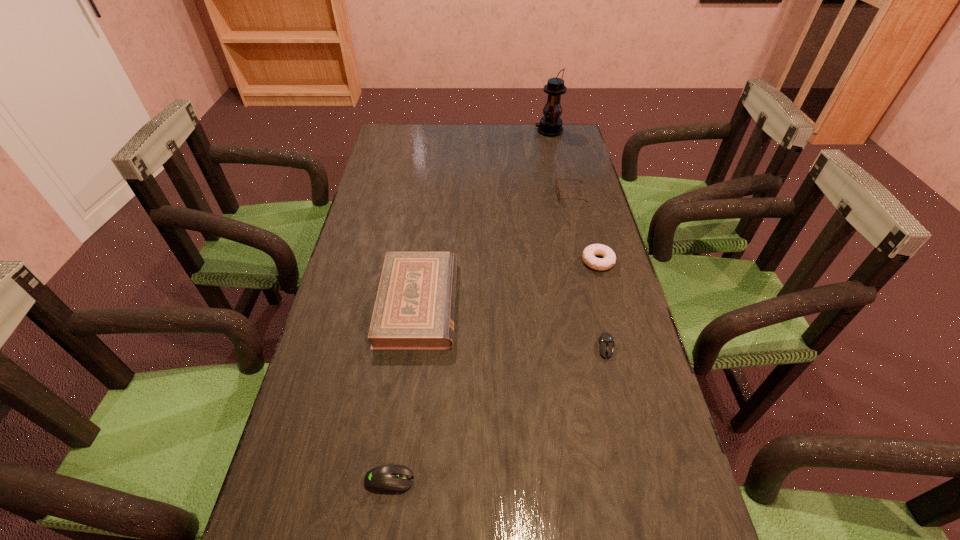
This screenshot has height=540, width=960. I want to click on the farthest object, so click(550, 125).

You are a GUI agent. You are given a task and a screenshot of the screen. Output one action in this format:
    pyautogui.click(x=<x>, y=<y>)
    Task: Click on the lantern
    The image size is (960, 540).
    Given the screenshot: What is the action you would take?
    click(550, 125)

Locate an element on the screen. sunglasses is located at coordinates tap(556, 188).

Where is `Bible`? Bible is located at coordinates (414, 309).

You are a GUI agent. You are given a task and a screenshot of the screen. Output one action in this format:
    pyautogui.click(x=<x>, y=<y>)
    Task: Click on the fourth tallest object
    This screenshot has width=960, height=540.
    Given the screenshot: What is the action you would take?
    pyautogui.click(x=589, y=253)

Find the location of a particular element. the fifth tallest object is located at coordinates (388, 479).

Locate an element on the screen. The width and height of the screenshot is (960, 540). the left computer mouse is located at coordinates (388, 479).

Locate an element on the screen. This screenshot has height=540, width=960. the farther computer mouse is located at coordinates (606, 341).

Find the location of a particular element. The image size is (960, 540). the shortest object is located at coordinates (606, 341).

Identify a few places in vacant region located above the farthest object, indicating its light source. Please provide its 2D coordinates. Your answer should be formatted as a tuple, i.e. [(x, y)], where the tuple contains the x and y coordinates of a point satisfying the conditions above.

[(516, 131)]